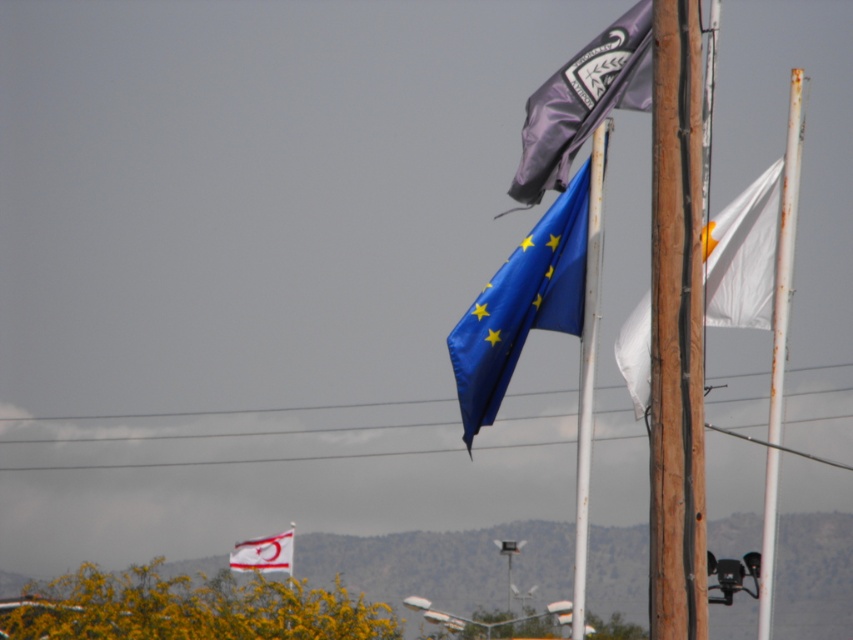
Who is more forward, [585,492] or [252,547]?

Point [585,492]

Can you confirm if wooden pole at center-right is positioned above white fabric flag at lower center?

Yes, wooden pole at center-right is above white fabric flag at lower center.

Is point (596, 177) in front of point (244, 556)?

Yes, it is in front of point (244, 556).

In order to click on wooden pole at center-right in this screenshot , I will do `click(587, 371)`.

Between wooden pole at right and white fabric flag at lower center, which one is positioned higher?

wooden pole at right is above.

Which is more to the left, wooden pole at right or white fabric flag at lower center?

white fabric flag at lower center

Does point (671, 96) lie behind point (251, 560)?

That is False.

Identify the location of wooden pole at right. The width and height of the screenshot is (853, 640). (676, 330).

Between purple matte flag at upper center and white fabric flag at right, which one has more height?

Standing taller between the two is white fabric flag at right.

Does point (614, 33) come closer to viewer compared to point (769, 278)?

That is False.

This screenshot has width=853, height=640. What are the coordinates of `purple matte flag at upper center` in the screenshot? It's located at (583, 100).